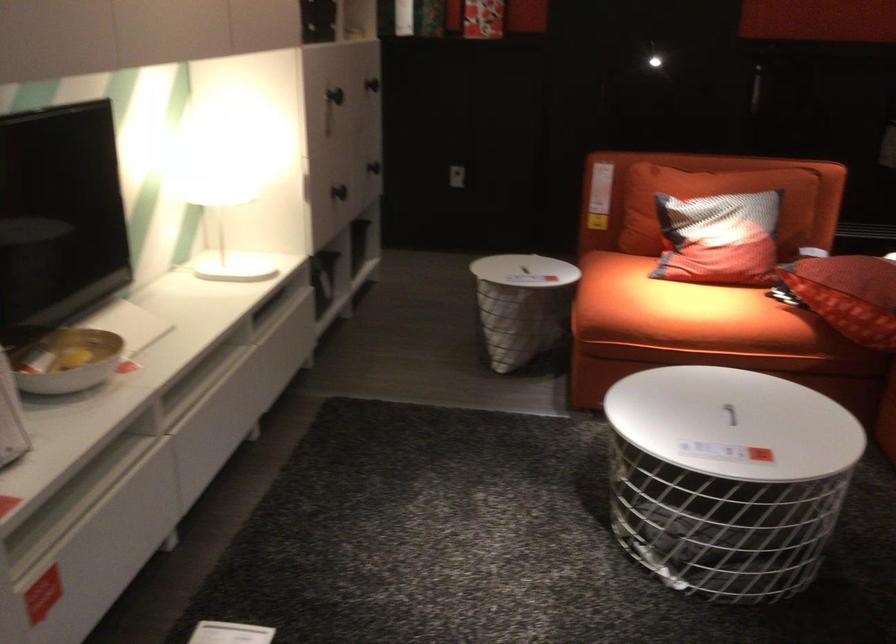
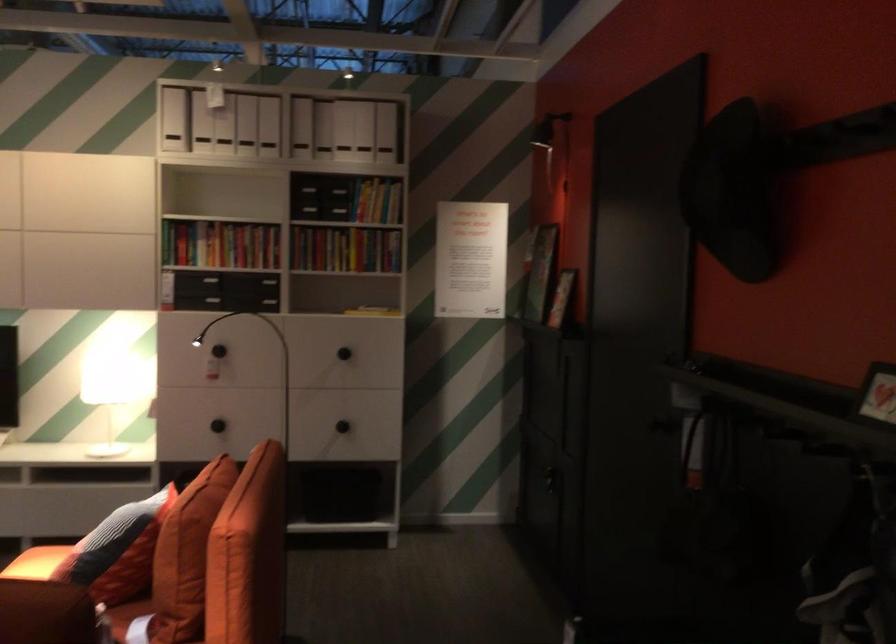
The point at (789, 207) is marked in the first image. Where is the corresponding point in the second image?

(117, 551)